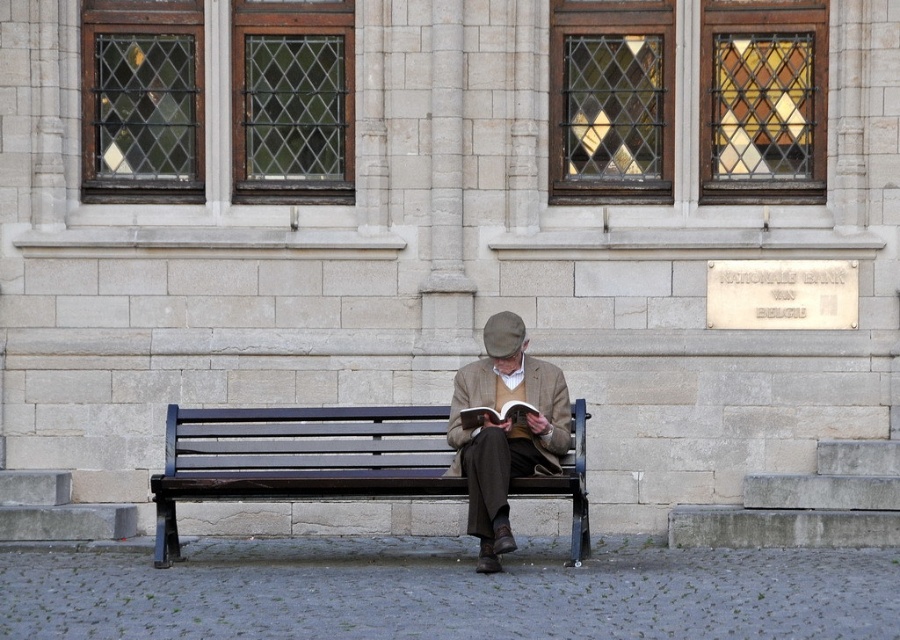
You are standing in front of the National Bank of Belgium and want to take a photo of the two points mentioned. Which point is closer to you, point (x=464, y=368) or point (x=730, y=262)?

Point (x=464, y=368) is closer to the viewer than point (x=730, y=262).

You are standing in front of the National Bank of Belgium, observing the scene. There are two points marked in the image. Which point is closer to you, point (806, 284) or point (462, 422)?

Point (806, 284) is further to the viewer than point (462, 422), so the closer point to you is point (462, 422).